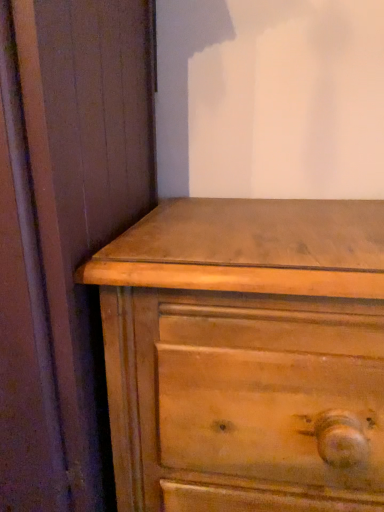
What do you see at coordinates (243, 353) in the screenshot? This screenshot has width=384, height=512. I see `light brown wood chest of drawers at center` at bounding box center [243, 353].

Identify the location of light brown wood chest of drawers at center. Image resolution: width=384 pixels, height=512 pixels. (243, 353).

At what (x,y) coordinates should I click in order to perform the action: click on matte wood dresser at lower right. Please return your answer as a coordinate pair (x, y). The image size is (384, 512). Looking at the image, I should click on (65, 233).

Describe the element at coordinates (65, 233) in the screenshot. This screenshot has height=512, width=384. I see `matte wood dresser at lower right` at that location.

Find the location of a particular element. This screenshot has height=512, width=384. light brown wood chest of drawers at center is located at coordinates (243, 353).

Which object is positioned more to the left, matte wood dresser at lower right or light brown wood chest of drawers at center?

From the viewer's perspective, matte wood dresser at lower right appears more on the left side.

Is the depth of matte wood dresser at lower right less than that of light brown wood chest of drawers at center?

Yes, the depth of matte wood dresser at lower right is less than that of light brown wood chest of drawers at center.

Considering the points (56, 309) and (373, 326), which point is in front, point (56, 309) or point (373, 326)?

Point (56, 309)

From the image's perspective, is matte wood dresser at lower right under light brown wood chest of drawers at center?

No.

From a real-world perspective, is matte wood dresser at lower right physically below light brown wood chest of drawers at center?

Incorrect, from a real-world perspective, matte wood dresser at lower right is higher than light brown wood chest of drawers at center.

Can you confirm if matte wood dresser at lower right is thinner than light brown wood chest of drawers at center?

No.

In terms of height, does matte wood dresser at lower right look taller or shorter compared to light brown wood chest of drawers at center?

Considering their sizes, matte wood dresser at lower right has more height than light brown wood chest of drawers at center.

Based on the photo, considering the sizes of matte wood dresser at lower right and light brown wood chest of drawers at center in the image, is matte wood dresser at lower right bigger or smaller than light brown wood chest of drawers at center?

Considering their sizes, matte wood dresser at lower right takes up more space than light brown wood chest of drawers at center.

Do you think matte wood dresser at lower right is within light brown wood chest of drawers at center, or outside of it?

matte wood dresser at lower right cannot be found inside light brown wood chest of drawers at center.

In the scene shown: Is matte wood dresser at lower right touching light brown wood chest of drawers at center?

No, matte wood dresser at lower right is not making contact with light brown wood chest of drawers at center.

Is matte wood dresser at lower right oriented away from light brown wood chest of drawers at center?

No.

The height and width of the screenshot is (512, 384). Identify the location of screen door on the left of light brown wood chest of drawers at center. (65, 233).

Which is more to the left, light brown wood chest of drawers at center or matte wood dresser at lower right?

matte wood dresser at lower right is more to the left.

Considering the relative positions of light brown wood chest of drawers at center and matte wood dresser at lower right in the image provided, is light brown wood chest of drawers at center behind matte wood dresser at lower right?

Yes, the depth of light brown wood chest of drawers at center is greater than that of matte wood dresser at lower right.

Does point (118, 377) come farther from viewer compared to point (33, 440)?

Yes, point (118, 377) is behind point (33, 440).

From the image's perspective, between light brown wood chest of drawers at center and matte wood dresser at lower right, who is located below?

light brown wood chest of drawers at center is shown below in the image.

From a real-world perspective, which object rests below the other?

light brown wood chest of drawers at center, from a real-world perspective.

Which of these two, light brown wood chest of drawers at center or matte wood dresser at lower right, is thinner?

light brown wood chest of drawers at center.

Can you confirm if light brown wood chest of drawers at center is shorter than matte wood dresser at lower right?

Indeed, light brown wood chest of drawers at center has a lesser height compared to matte wood dresser at lower right.

Can you confirm if light brown wood chest of drawers at center is smaller than matte wood dresser at lower right?

Yes.

Does light brown wood chest of drawers at center contain matte wood dresser at lower right?

That's incorrect, matte wood dresser at lower right is not inside light brown wood chest of drawers at center.

Are light brown wood chest of drawers at center and matte wood dresser at lower right far apart?

Result: No.

Is light brown wood chest of drawers at center positioned with its back to matte wood dresser at lower right?

No, light brown wood chest of drawers at center's orientation is not away from matte wood dresser at lower right.

The image size is (384, 512). I want to click on chest of drawers below the matte wood dresser at lower right (from the image's perspective), so click(x=243, y=353).

Identify the location of screen door above the light brown wood chest of drawers at center (from the image's perspective). This screenshot has width=384, height=512. (65, 233).

Find the location of a particular element. The width and height of the screenshot is (384, 512). the chest of drawers lying below the matte wood dresser at lower right (from the image's perspective) is located at coordinates (243, 353).